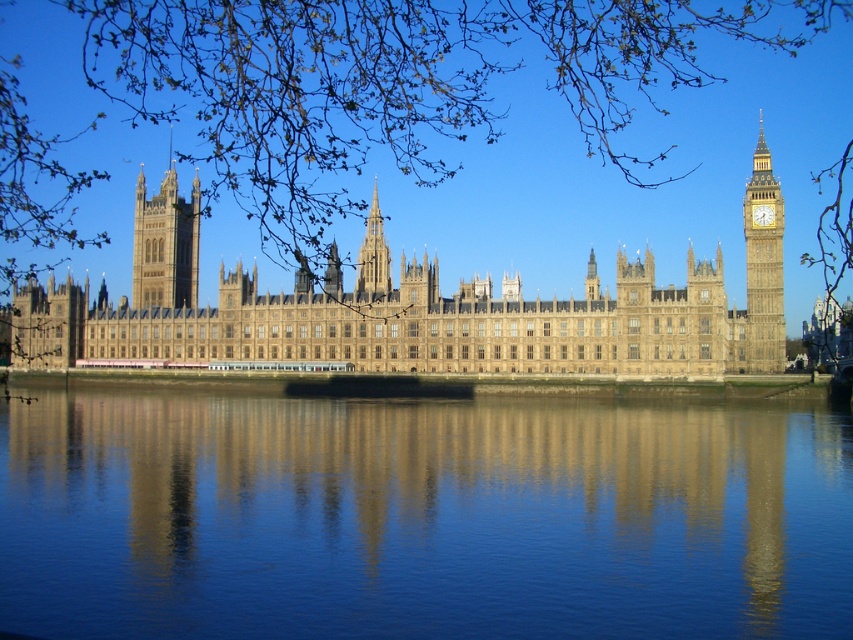
Which is above, smooth blue water at center or golden stone tower at center?

golden stone tower at center is higher up.

Is point (254, 424) closer to viewer compared to point (194, 296)?

Yes, point (254, 424) is in front of point (194, 296).

At what (x,y) coordinates should I click in order to perform the action: click on smooth blue water at center. Please return your answer as a coordinate pair (x, y). Image resolution: width=853 pixels, height=640 pixels. Looking at the image, I should click on (421, 516).

Does golden stone clock tower at right come in front of golden stone tower at center?

Yes, it is.

The height and width of the screenshot is (640, 853). Describe the element at coordinates (763, 268) in the screenshot. I see `golden stone clock tower at right` at that location.

This screenshot has width=853, height=640. Find the location of `golden stone clock tower at right`. golden stone clock tower at right is located at coordinates (763, 268).

This screenshot has height=640, width=853. Identify the location of golden stone clock tower at right. (763, 268).

Measure the distance between golden stone castle at center and golden stone tower at center.

6.62 meters

This screenshot has width=853, height=640. Describe the element at coordinates (419, 307) in the screenshot. I see `golden stone castle at center` at that location.

I want to click on golden stone castle at center, so click(x=419, y=307).